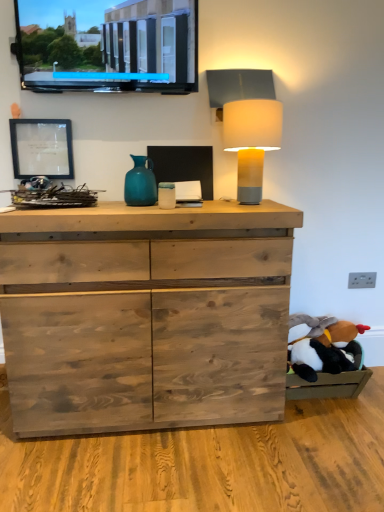
Question: Can you confirm if black plush toy at lower right is thinner than matte black screen at upper left?

Choices:
 (A) no
 (B) yes

Answer: (A)

Question: Is black plush toy at lower right next to matte black screen at upper left?

Choices:
 (A) no
 (B) yes

Answer: (A)

Question: From a real-world perspective, is black plush toy at lower right on top of matte black screen at upper left?

Choices:
 (A) no
 (B) yes

Answer: (A)

Question: Could matte black screen at upper left be considered to be inside black plush toy at lower right?

Choices:
 (A) no
 (B) yes

Answer: (A)

Question: Considering the relative sizes of black plush toy at lower right and matte black screen at upper left in the image provided, is black plush toy at lower right wider than matte black screen at upper left?

Choices:
 (A) no
 (B) yes

Answer: (B)

Question: In terms of width, does natural wood chest of drawers at center look wider or thinner when compared to matte yellow lampshade at upper right?

Choices:
 (A) thin
 (B) wide

Answer: (B)

Question: From the image's perspective, is natural wood chest of drawers at center above or below matte yellow lampshade at upper right?

Choices:
 (A) above
 (B) below

Answer: (B)

Question: Considering the positions of natural wood chest of drawers at center and matte yellow lampshade at upper right in the image, is natural wood chest of drawers at center taller or shorter than matte yellow lampshade at upper right?

Choices:
 (A) short
 (B) tall

Answer: (B)

Question: Considering the positions of natural wood chest of drawers at center and matte yellow lampshade at upper right in the image, is natural wood chest of drawers at center bigger or smaller than matte yellow lampshade at upper right?

Choices:
 (A) big
 (B) small

Answer: (A)

Question: In terms of width, does matte glass picture frame at upper left look wider or thinner when compared to natural wood chest of drawers at center?

Choices:
 (A) wide
 (B) thin

Answer: (B)

Question: In the image, is matte glass picture frame at upper left positioned in front of or behind natural wood chest of drawers at center?

Choices:
 (A) behind
 (B) front

Answer: (A)

Question: Is matte glass picture frame at upper left situated inside natural wood chest of drawers at center or outside?

Choices:
 (A) outside
 (B) inside

Answer: (A)

Question: From the image's perspective, is matte glass picture frame at upper left located above or below natural wood chest of drawers at center?

Choices:
 (A) above
 (B) below

Answer: (A)

Question: Considering the positions of natural wood chest of drawers at center and teal glass vase at center in the image, is natural wood chest of drawers at center wider or thinner than teal glass vase at center?

Choices:
 (A) wide
 (B) thin

Answer: (A)

Question: Considering their positions, is natural wood chest of drawers at center located in front of or behind teal glass vase at center?

Choices:
 (A) front
 (B) behind

Answer: (A)